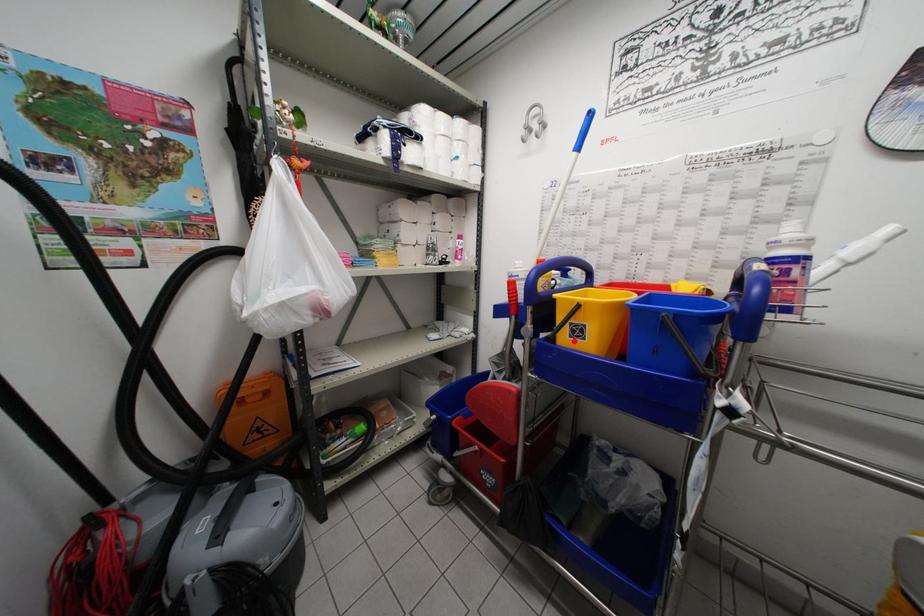
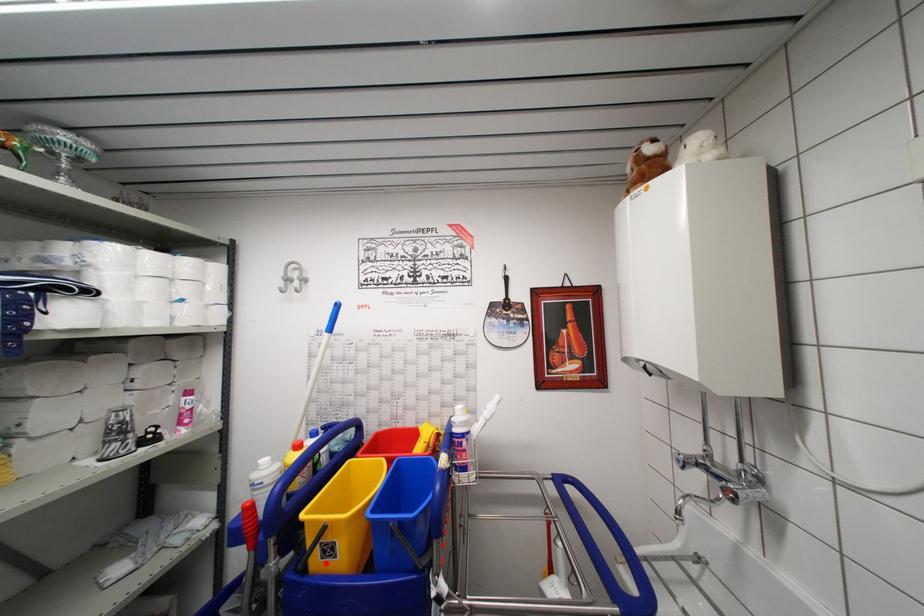
I am providing you with two images of the same scene from different viewpoints. A red point is marked on the first image and another point is marked on the second image. Is the red point in image1 aligned with the point shown in image2?

Yes